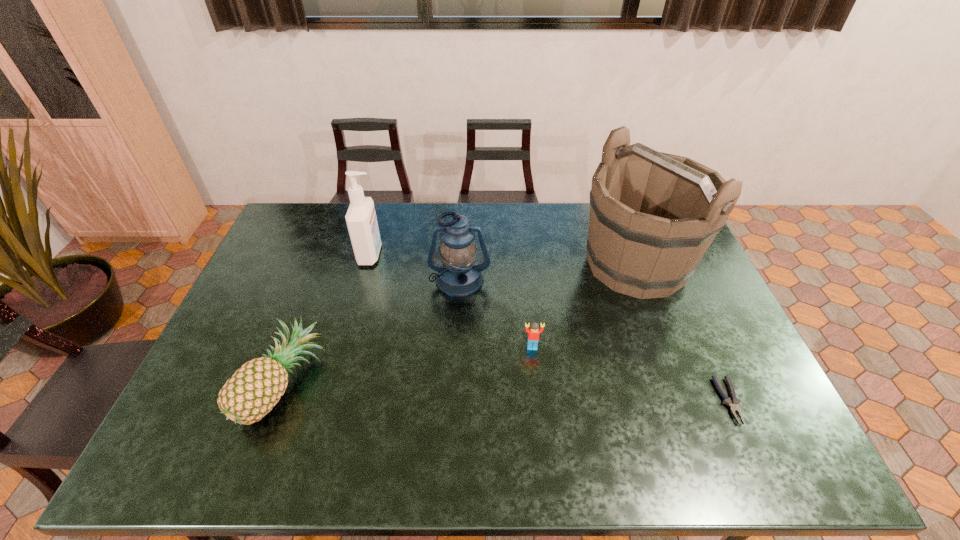
I want to click on bucket, so click(x=653, y=215).

I want to click on the second tallest object, so click(x=361, y=220).

The image size is (960, 540). I want to click on the fourth object from right to left, so click(459, 276).

At what (x,y) coordinates should I click in order to perform the action: click on lantern. Please return your answer as a coordinate pair (x, y). Image resolution: width=960 pixels, height=540 pixels. Looking at the image, I should click on (459, 276).

Find the location of a particular element. The image size is (960, 540). the third shortest object is located at coordinates (255, 388).

Locate an element on the screen. The height and width of the screenshot is (540, 960). Lego is located at coordinates (533, 332).

Where is `the fourth object from left to right`? the fourth object from left to right is located at coordinates (533, 332).

I want to click on the shortest object, so click(733, 403).

What are the coordinates of `vacant area located 0.220m on the left of the bucket` in the screenshot? It's located at pos(513,264).

Locate an element on the screen. This screenshot has height=540, width=960. vacant area located 0.370m on the front label of the cleansing agent is located at coordinates 491,254.